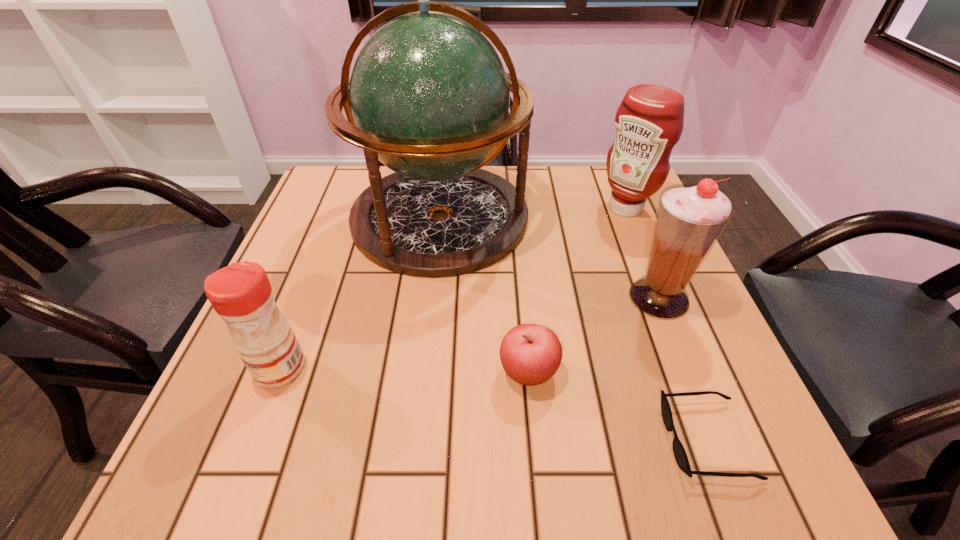
The height and width of the screenshot is (540, 960). What are the coordinates of `globe` in the screenshot? It's located at (429, 97).

This screenshot has height=540, width=960. In order to click on the taller condiment in this screenshot , I will do `click(649, 121)`.

Where is `the right condiment`? This screenshot has width=960, height=540. the right condiment is located at coordinates (649, 121).

At what (x,y) coordinates should I click in order to perform the action: click on smoothie. Please return your answer as a coordinate pair (x, y). The image size is (960, 540). Looking at the image, I should click on (690, 218).

The width and height of the screenshot is (960, 540). I want to click on the left condiment, so click(x=241, y=294).

Locate an element on the screen. Image resolution: width=960 pixels, height=540 pixels. the third shortest object is located at coordinates (241, 294).

Locate an element on the screen. The height and width of the screenshot is (540, 960). apple is located at coordinates (530, 354).

Locate an element on the screen. the shortest object is located at coordinates (680, 455).

Where is `sunglasses`? Image resolution: width=960 pixels, height=540 pixels. sunglasses is located at coordinates pos(680,455).

Image resolution: width=960 pixels, height=540 pixels. What are the coordinates of `vacant space located on the front-facing side of the tallest object` in the screenshot? It's located at (414, 458).